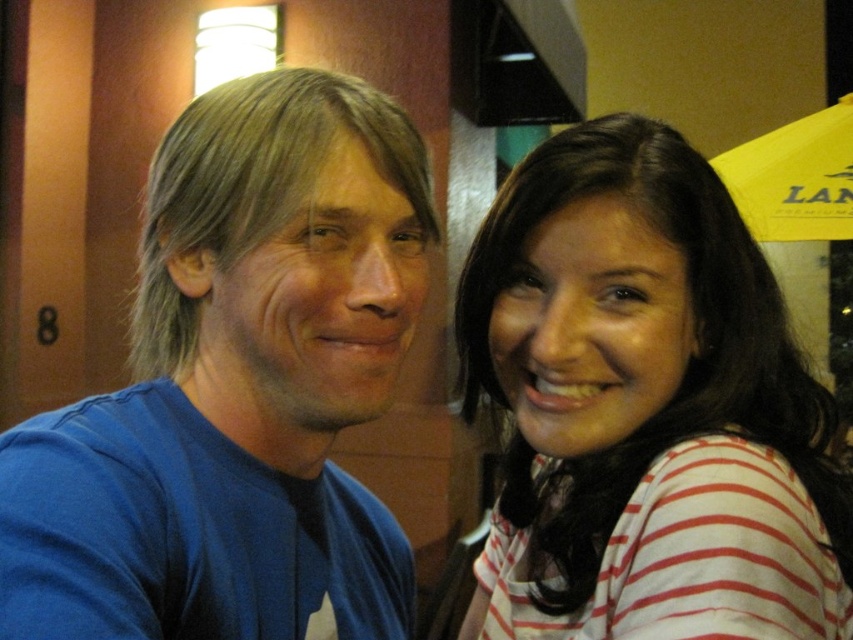
You are taking a photo of two people in a cafe. You notice two points in the image at coordinates point (285,394) and point (811,132). Which point is closer to you?

Point (285,394) is closer to the viewer than point (811,132).

You are taking a photo of two people in a cafe. The camera is positioned at a certain distance from the point labeled as point (160,205). If the recommended distance for clear photos is at least 20 inches, is the camera positioned correctly?

The point (160,205) and camera are 21.39 inches apart, which meets the recommended distance of at least 20 inches, so the camera is positioned correctly.

You are a photographer standing in a cafe and want to take a photo of the white striped shirt at right and the yellow fabric umbrella at upper right. The minimum distance your camera can focus on two objects is 6 feet. Can you capture both in focus?

The white striped shirt at right is 7.02 feet from the yellow fabric umbrella at upper right, so the distance between them is greater than the camera minimum focus distance of 6 feet. Therefore, the camera can focus on both objects.